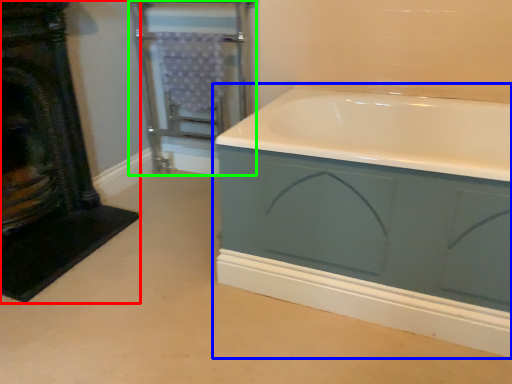
Question: Estimate the real-world distances between objects in this image. Which object is farther from fireplace (highlighted by a red box), bathtub (highlighted by a blue box) or screen door (highlighted by a green box)?

Choices:
 (A) bathtub
 (B) screen door

Answer: (A)